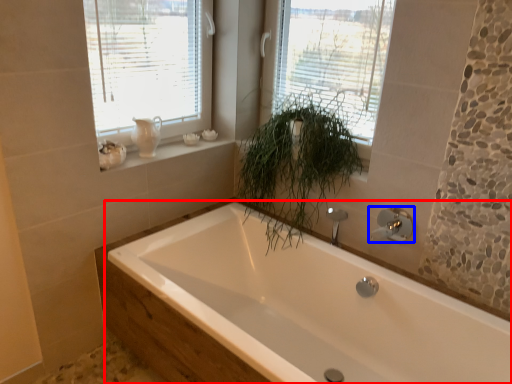
Question: Which point is further to the camera, bathtub (highlighted by a red box) or tap (highlighted by a blue box)?

Choices:
 (A) bathtub
 (B) tap

Answer: (B)